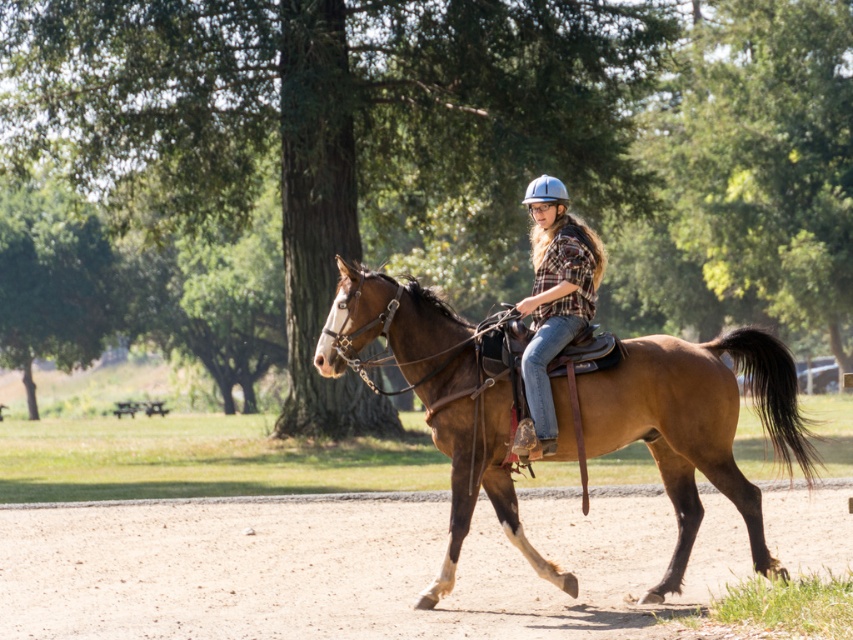
Question: Which of these objects is positioned farthest from the silver metallic helmet at center?

Choices:
 (A) plaid fabric shirt at center
 (B) brown leather saddle at center
 (C) brown dirt track at lower center

Answer: (C)

Question: Does brown dirt track at lower center appear on the left side of brown leather saddle at center?

Choices:
 (A) no
 (B) yes

Answer: (B)

Question: Considering the real-world distances, which object is farthest from the brown dirt track at lower center?

Choices:
 (A) plaid fabric shirt at center
 (B) brown leather saddle at center
 (C) silver metallic helmet at center

Answer: (C)

Question: Does brown dirt track at lower center appear under silver metallic helmet at center?

Choices:
 (A) no
 (B) yes

Answer: (B)

Question: Observing the image, what is the correct spatial positioning of brown leather saddle at center in reference to silver metallic helmet at center?

Choices:
 (A) above
 (B) below

Answer: (B)

Question: Estimate the real-world distances between objects in this image. Which object is farther from the brown leather saddle at center?

Choices:
 (A) plaid fabric shirt at center
 (B) brown dirt track at lower center

Answer: (B)